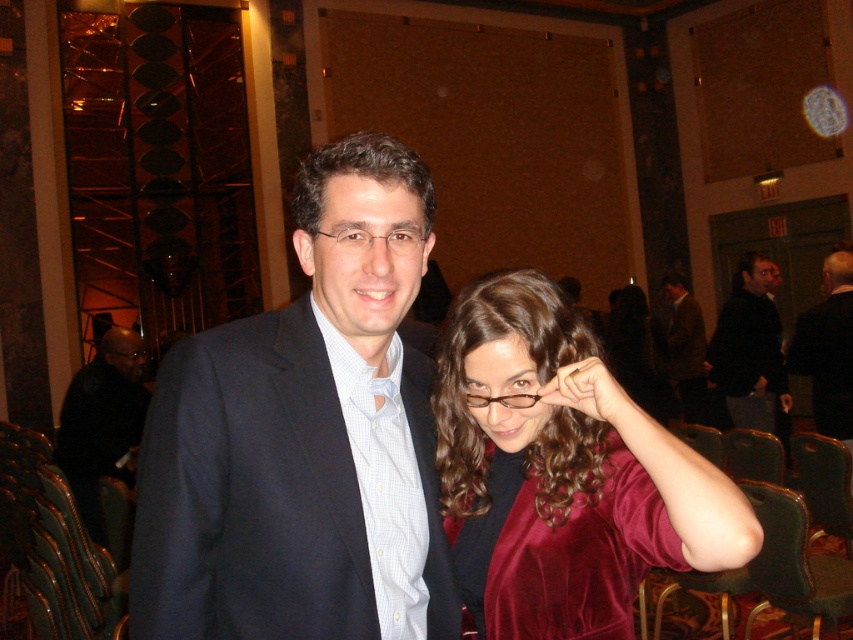
You are standing in the formal event space and see two points marked on the wall. The first point is at coordinate point (607, 512) and the second point is at coordinate point (703, 419). Which point is closer to you?

Point (607, 512) is closer to the viewer than point (703, 419).

Looking at this image, you are a guest at this event and notice two pairs of glasses on the table. The clear plastic glasses at center and the matte black glasses at upper center. Which pair is positioned higher on the table?

The clear plastic glasses at center is positioned higher on the table than the matte black glasses at upper center.